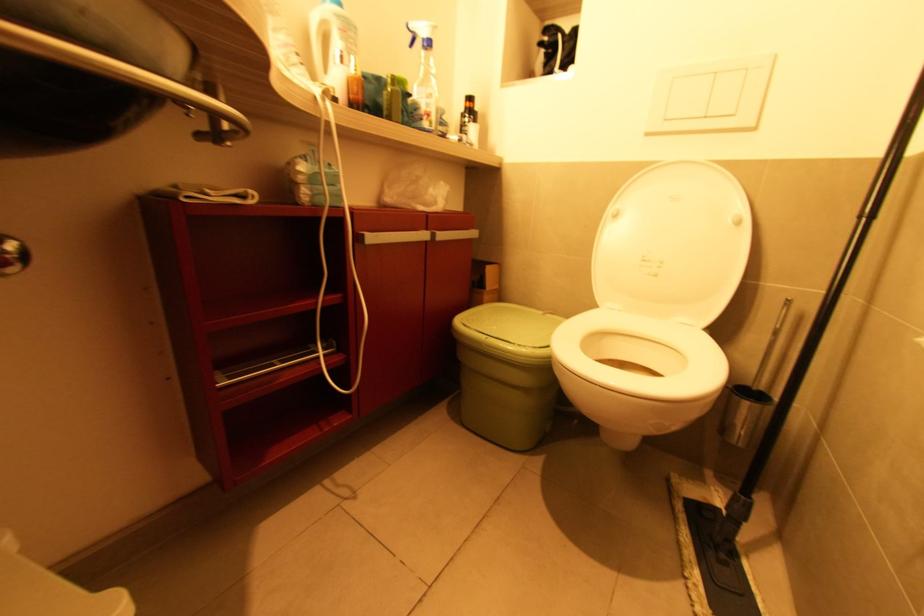
I want to click on silver cabinet handle, so click(392, 237).